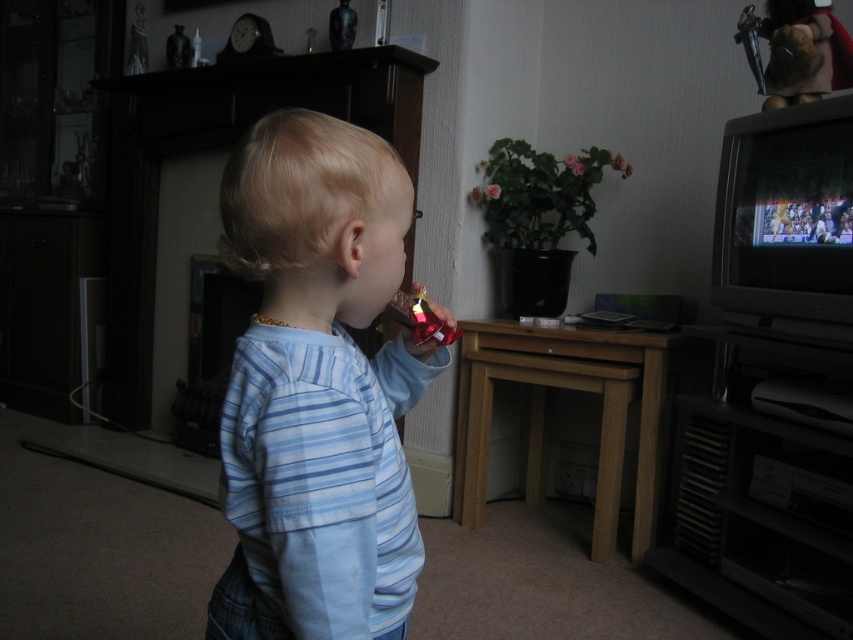
You are a photographer setting up for a family photo in the living room. You need to ensure the blue striped shirt at center and the metallic gray television at right are both visible in the frame. Based on their positions, will the television be visible behind the shirt?

The blue striped shirt at center is positioned over the metallic gray television at right, so the television will not be fully visible behind the shirt.

You are a photographer setting up a shoot in this living room. You need to position a light source between the blue striped shirt at center and the metallic gray television at right. Based on their positions, where should you place the light source?

The blue striped shirt at center is to the left of the metallic gray television at right, so the light source should be placed between them, to the right of the blue striped shirt at center and to the left of the metallic gray television at right.